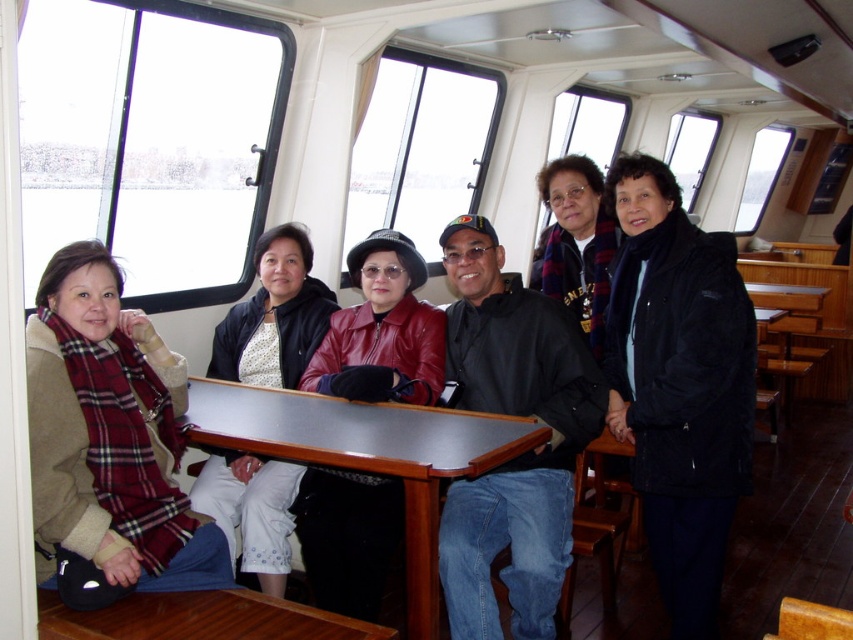
Question: Is the position of plaid scarf at left more distant than that of metallic polished table at center?

Choices:
 (A) no
 (B) yes

Answer: (A)

Question: In this image, where is metallic polished table at center located relative to white textured pants at center?

Choices:
 (A) left
 (B) right

Answer: (B)

Question: Which point appears closest to the camera in this image?

Choices:
 (A) click(213, 353)
 (B) click(322, 566)
 (C) click(108, 378)
 (D) click(241, 392)

Answer: (C)

Question: Does leather jacket at center appear under white textured pants at center?

Choices:
 (A) no
 (B) yes

Answer: (B)

Question: Considering the real-world distances, which object is farthest from the metallic polished table at center?

Choices:
 (A) plaid scarf at left
 (B) leather jacket at center

Answer: (A)

Question: Among these points, which one is nearest to the camera?

Choices:
 (A) [x=378, y=547]
 (B) [x=247, y=509]
 (C) [x=413, y=595]

Answer: (C)